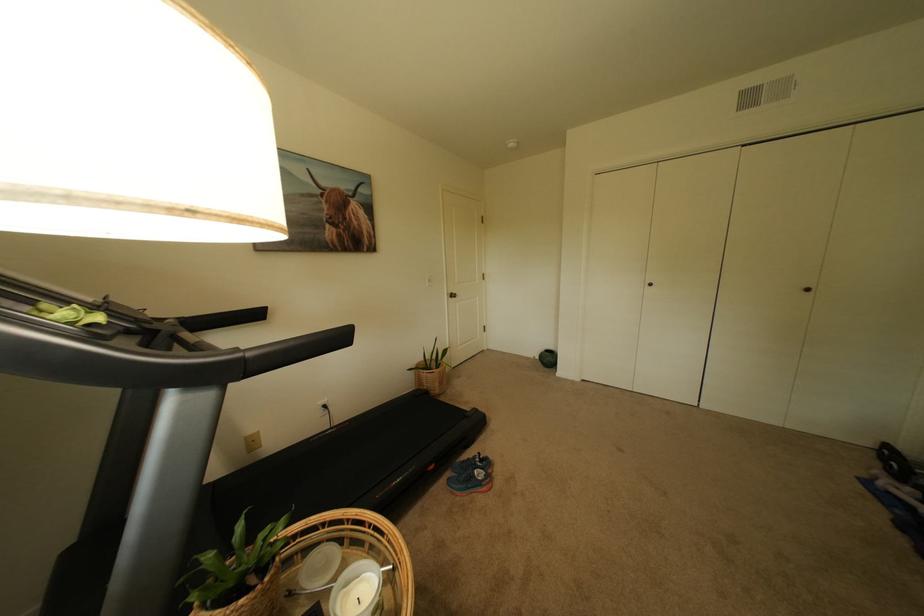
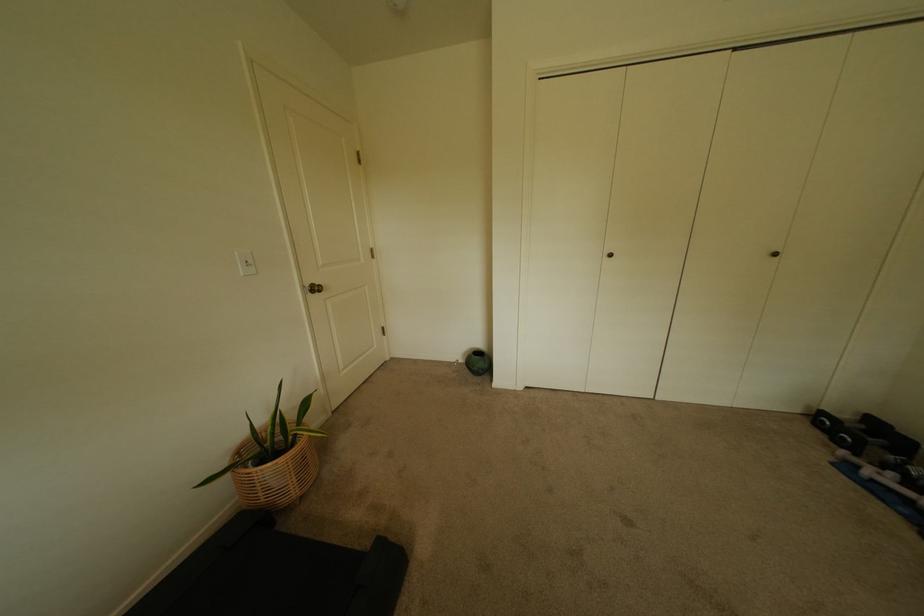
Find the pixel in the second image that matches (659,286) in the first image.

(618, 256)